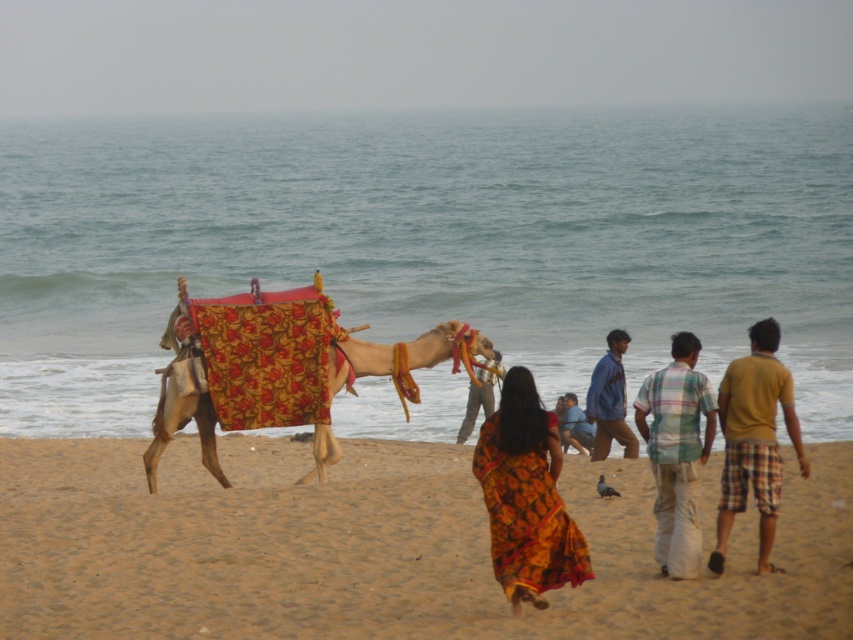
Between point (618, 344) and point (567, 422), which one is positioned in front?

Point (618, 344)

Measure the distance between blue denim shirt at center and camera.

61.93 feet

Identify the location of blue denim shirt at center. (610, 401).

Locate an element on the screen. Image resolution: width=853 pixels, height=640 pixels. blue denim shirt at center is located at coordinates (610, 401).

Does yellow plaid shorts at right appear on the left side of blue plaid shirt at center?

In fact, yellow plaid shorts at right is to the right of blue plaid shirt at center.

Does point (712, 564) lie in front of point (579, 451)?

Yes, it is.

The image size is (853, 640). I want to click on yellow plaid shorts at right, so click(x=753, y=440).

Which is more to the right, plaid cotton shirt at center right or blue denim shirt at center?

blue denim shirt at center

Between point (666, 536) and point (614, 429), which one is positioned behind?

The point (614, 429) is behind.

Who is more forward, (653, 454) or (606, 428)?

Point (653, 454) is more forward.

I want to click on plaid cotton shirt at center right, so click(x=676, y=452).